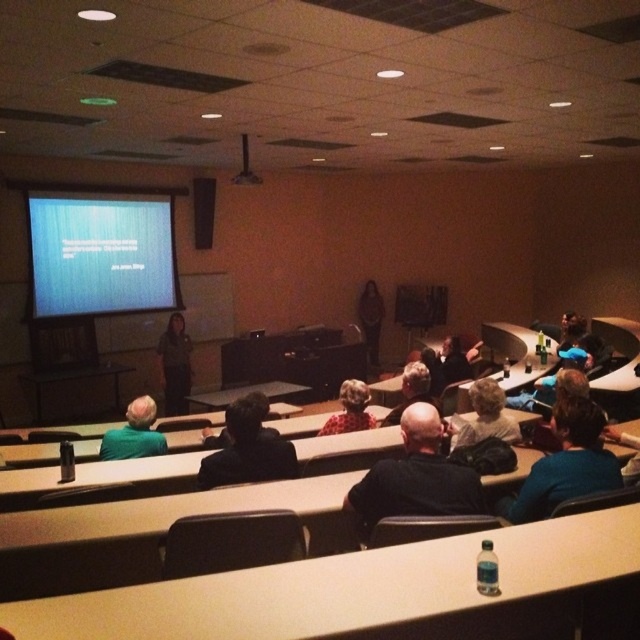
You are sitting at the back of the lecture hall and want to ask a question to the person with light brown hair at center and the person with dark gray hair at center. Which individual will you need to lean forward less to address?

The light brown hair at center is closer to the viewer than dark gray hair at center, so you will need to lean forward less to address the light brown hair at center.

You are an attendee in the lecture hall and want to take a photo of the presentation. Since the room is dimly lit, you need to ensure the black plastic projector at upper center isn not casting a shadow on the matte blue screen at upper left. Can you adjust your position to avoid the shadow?

The matte blue screen at upper left is positioned under the black plastic projector at upper center. Since the projector is above the screen, adjusting your position might not eliminate the shadow. It would be best to ask the presenter to adjust the projector or use a different angle to capture the screen without obstruction.